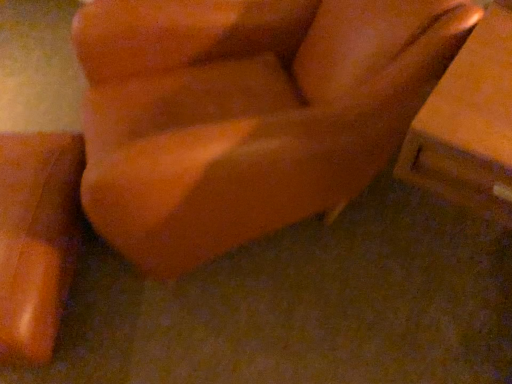
Question: From the image's perspective, is matte orange chair at center, acting as the 2th furniture starting from the left, located above or below matte orange vase at lower left, which ranks as the second furniture in right-to-left order?

Choices:
 (A) below
 (B) above

Answer: (B)

Question: Considering the positions of matte orange chair at center, marked as the first furniture in a right-to-left arrangement, and matte orange vase at lower left, the first furniture in the left-to-right sequence, in the image, is matte orange chair at center, marked as the first furniture in a right-to-left arrangement, taller or shorter than matte orange vase at lower left, the first furniture in the left-to-right sequence,?

Choices:
 (A) tall
 (B) short

Answer: (A)

Question: Do you think matte orange chair at center, marked as the first furniture in a right-to-left arrangement, is within matte orange vase at lower left, which ranks as the second furniture in right-to-left order, or outside of it?

Choices:
 (A) outside
 (B) inside

Answer: (A)

Question: Is matte orange vase at lower left, the first furniture in the left-to-right sequence, spatially inside matte orange chair at center, marked as the first furniture in a right-to-left arrangement, or outside of it?

Choices:
 (A) outside
 (B) inside

Answer: (A)

Question: From a real-world perspective, is matte orange vase at lower left, which ranks as the second furniture in right-to-left order, positioned above or below matte orange chair at center, marked as the first furniture in a right-to-left arrangement?

Choices:
 (A) below
 (B) above

Answer: (A)

Question: In the image, is matte orange vase at lower left, the first furniture in the left-to-right sequence, on the left side or the right side of matte orange chair at center, marked as the first furniture in a right-to-left arrangement?

Choices:
 (A) right
 (B) left

Answer: (B)

Question: Is matte orange vase at lower left, which ranks as the second furniture in right-to-left order, wider or thinner than matte orange chair at center, marked as the first furniture in a right-to-left arrangement?

Choices:
 (A) thin
 (B) wide

Answer: (A)